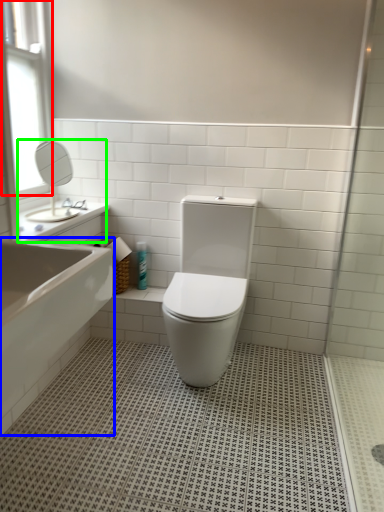
Question: Based on their relative distances, which object is nearer to window (highlighted by a red box)? Choose from bath (highlighted by a blue box) and sink (highlighted by a green box).

Choices:
 (A) bath
 (B) sink

Answer: (B)